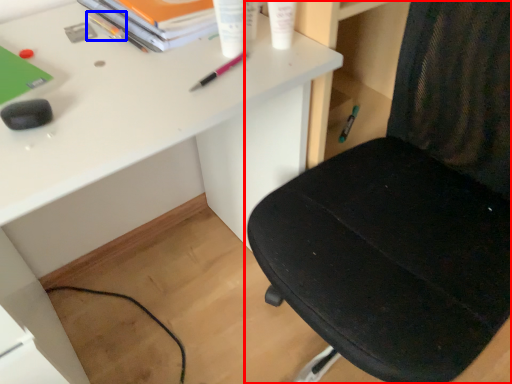
Question: Which point is closer to the camera, chair (highlighted by a red box) or stationery (highlighted by a blue box)?

Choices:
 (A) chair
 (B) stationery

Answer: (A)